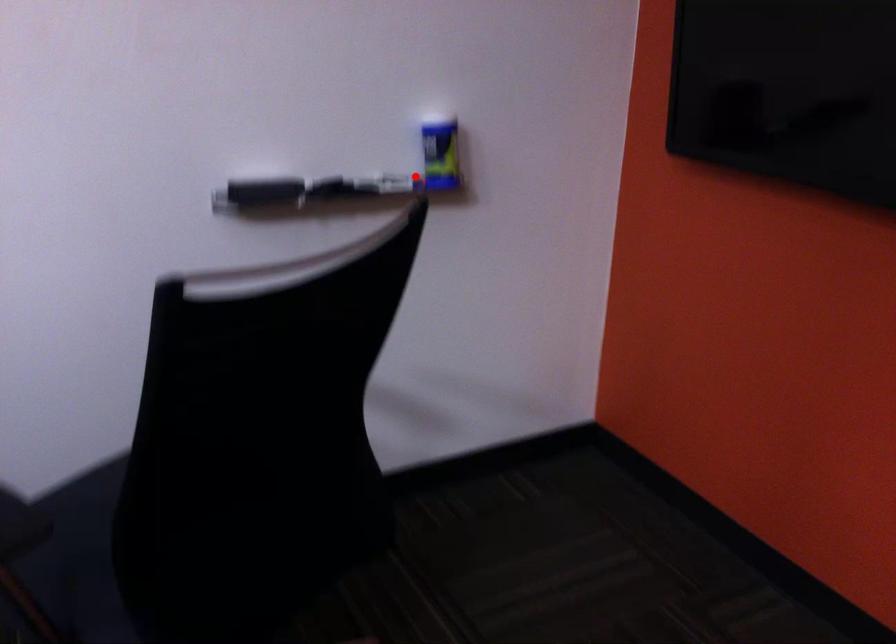
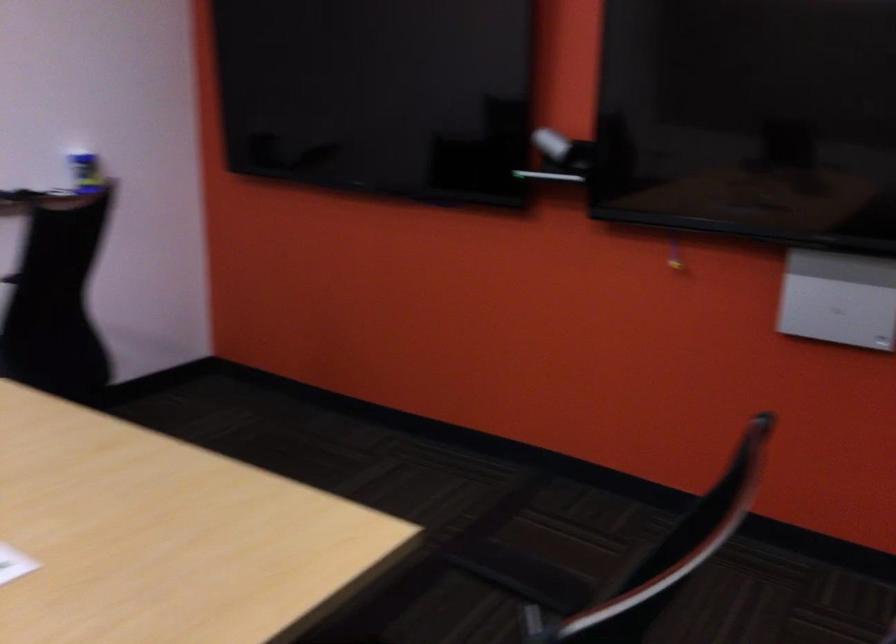
Locate, in the second image, the point that corresponds to the highlighted location in the first image.

(85, 172)